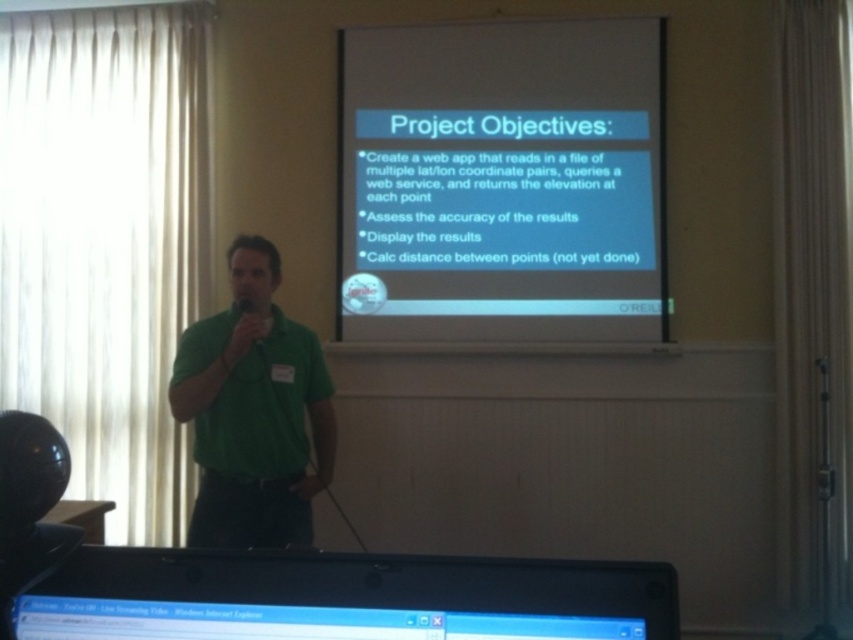
Who is positioned more to the right, black plastic monitor at lower center or green matte shirt at center?

black plastic monitor at lower center

Between black plastic monitor at lower center and green matte shirt at center, which one has more height?

green matte shirt at center is taller.

Between point (480, 621) and point (201, 461), which one is positioned behind?

The point (201, 461) is more distant.

Image resolution: width=853 pixels, height=640 pixels. I want to click on black plastic monitor at lower center, so click(x=343, y=596).

Who is positioned more to the right, white matte projector screen at upper center or black plastic monitor at lower center?

white matte projector screen at upper center is more to the right.

Is white matte projector screen at upper center taller than black plastic monitor at lower center?

Yes.

Is point (451, 225) behind point (132, 609)?

Yes, point (451, 225) is behind point (132, 609).

Locate an element on the screen. This screenshot has height=640, width=853. white matte projector screen at upper center is located at coordinates (502, 180).

What do you see at coordinates (502, 180) in the screenshot? This screenshot has width=853, height=640. I see `white matte projector screen at upper center` at bounding box center [502, 180].

Between point (584, 76) and point (318, 483), which one is positioned behind?

Point (584, 76)

At what (x,y) coordinates should I click in order to perform the action: click on white matte projector screen at upper center. Please return your answer as a coordinate pair (x, y). The width and height of the screenshot is (853, 640). Looking at the image, I should click on (502, 180).